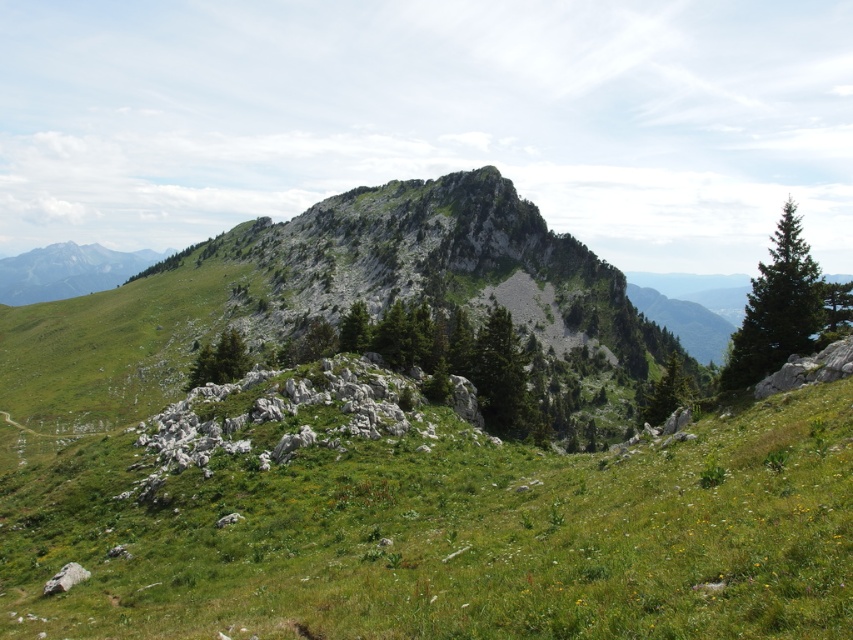
Question: Can you confirm if green grassy at center is positioned to the right of green matte tree at center-right?

Choices:
 (A) yes
 (B) no

Answer: (B)

Question: Does rugged stone mountain at center appear under green textured tree at center?

Choices:
 (A) no
 (B) yes

Answer: (A)

Question: Which point is farther to the camera?

Choices:
 (A) green grassy at center
 (B) green textured tree at center
 (C) rugged stone mountain at center

Answer: (C)

Question: Is rugged stone mountain at center closer to the viewer compared to green textured tree at center?

Choices:
 (A) yes
 (B) no

Answer: (B)

Question: Which point is farther to the camera?

Choices:
 (A) (247, 362)
 (B) (599, 628)
 (C) (404, 230)
 (D) (479, 381)

Answer: (C)

Question: Which object appears farthest from the camera in this image?

Choices:
 (A) green textured tree at center
 (B) green needle-like tree at right
 (C) rugged stone mountain at center

Answer: (C)